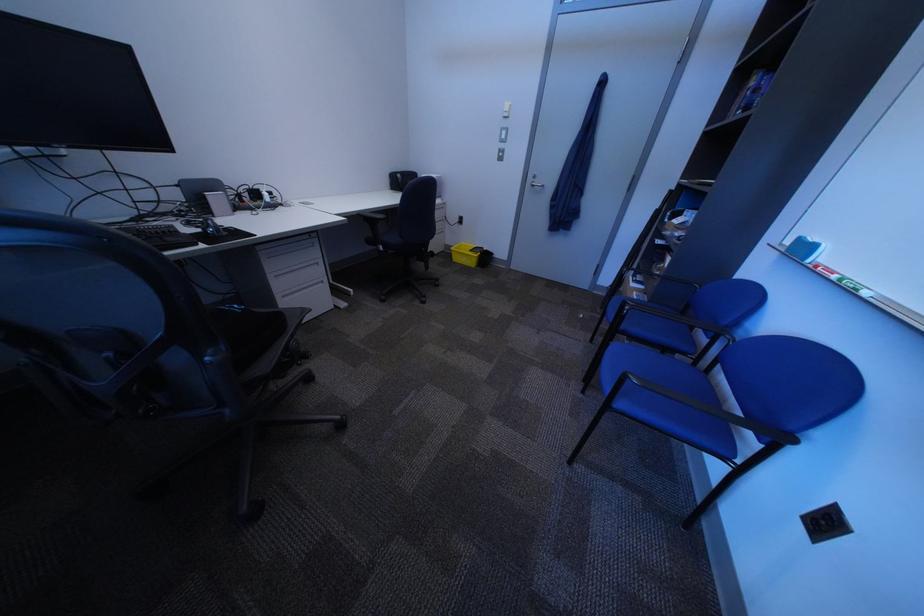
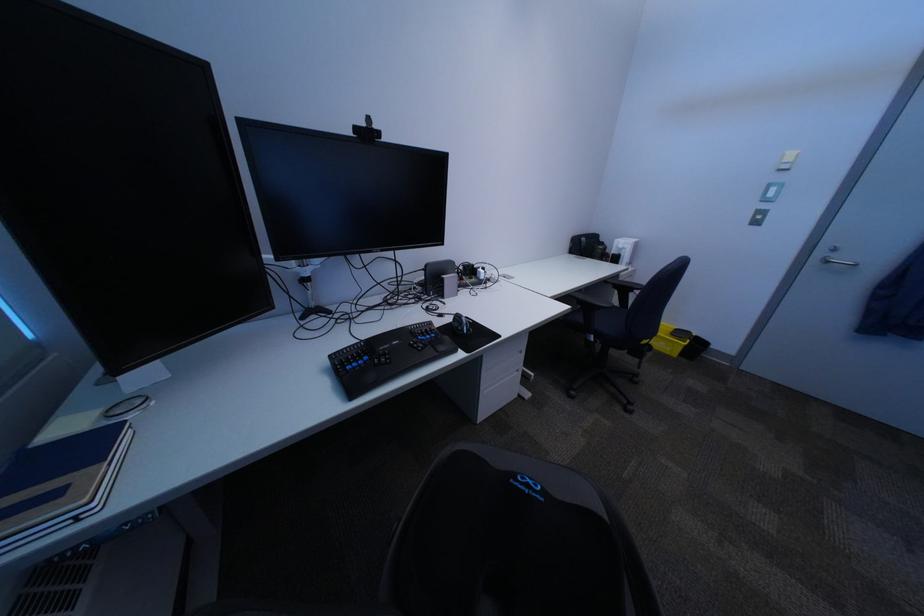
Where in the second image is the point corresponding to the point at 201,230 from the first image?

(454, 325)